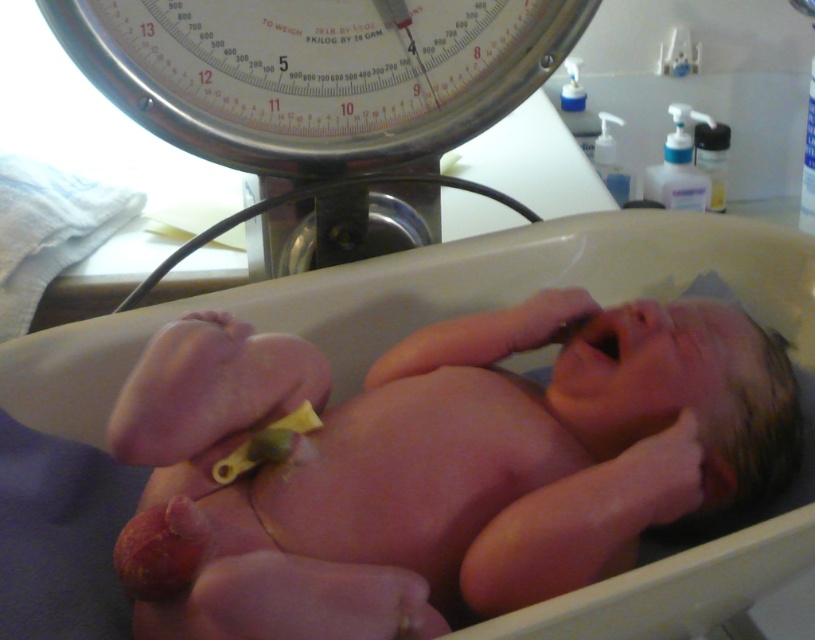
Question: Which point appears closest to the camera in this image?

Choices:
 (A) (421, 13)
 (B) (206, 376)

Answer: (B)

Question: Can you confirm if pink smooth skin at center is bigger than metallic scale at upper center?

Choices:
 (A) yes
 (B) no

Answer: (A)

Question: Can you confirm if pink smooth skin at center is smaller than metallic scale at upper center?

Choices:
 (A) no
 (B) yes

Answer: (A)

Question: Which point appears farthest from the camera in this image?

Choices:
 (A) (311, 150)
 (B) (760, 483)

Answer: (A)

Question: Does pink smooth skin at center appear on the left side of metallic scale at upper center?

Choices:
 (A) yes
 (B) no

Answer: (B)